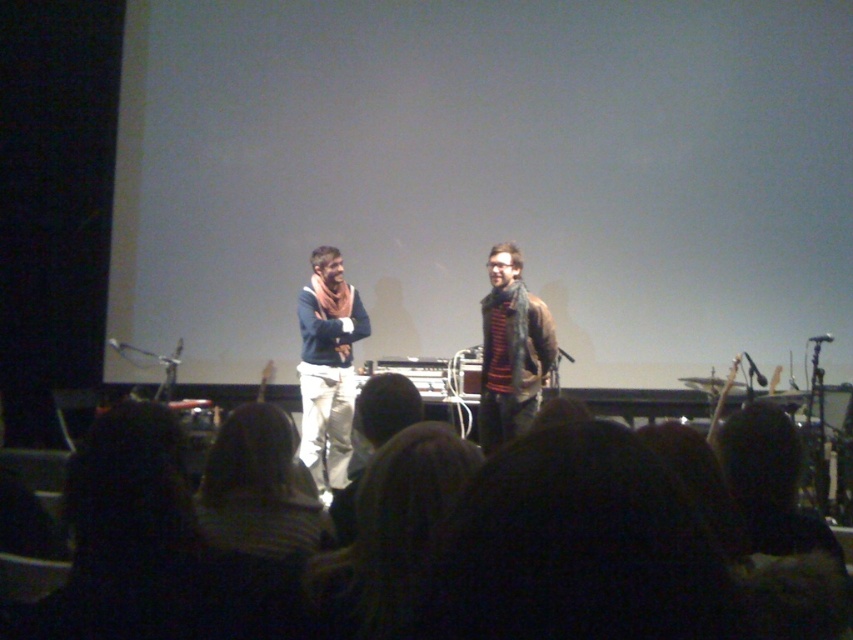
Identify the location of striped knit sweater at center. Image resolution: width=853 pixels, height=640 pixels. (511, 349).

Does point (505, 301) come closer to viewer compared to point (810, 337)?

Yes, it is in front of point (810, 337).

What are the coordinates of `striped knit sweater at center` in the screenshot? It's located at (511, 349).

Who is taller, matte blue sweater at center or metallic silver microphone at upper center?

matte blue sweater at center

Can you confirm if matte blue sweater at center is taller than metallic silver microphone at upper center?

Yes, matte blue sweater at center is taller than metallic silver microphone at upper center.

You are a GUI agent. You are given a task and a screenshot of the screen. Output one action in this format:
    pyautogui.click(x=<x>, y=<y>)
    Task: Click on the matte blue sweater at center
    This screenshot has width=853, height=640.
    Given the screenshot: What is the action you would take?
    pyautogui.click(x=328, y=365)

Where is `matte blue sweater at center`? matte blue sweater at center is located at coordinates (328, 365).

Who is more forward, (358, 321) or (485, 307)?

Point (485, 307) is in front.

Which is behind, point (338, 435) or point (523, 417)?

Positioned behind is point (338, 435).

Identify the location of matte blue sweater at center. The height and width of the screenshot is (640, 853). (328, 365).